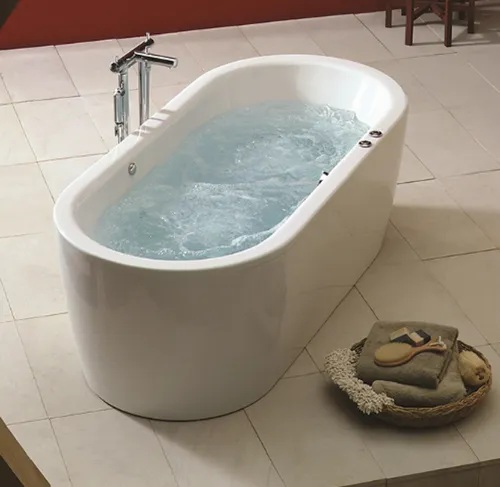
The image size is (500, 487). I want to click on red wall, so click(95, 16).